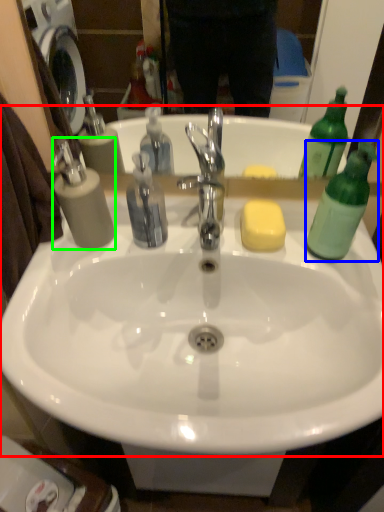
Question: Based on their relative distances, which object is nearer to sink (highlighted by a red box)? Choose from bottle (highlighted by a blue box) and soap dispenser (highlighted by a green box).

Choices:
 (A) bottle
 (B) soap dispenser

Answer: (B)